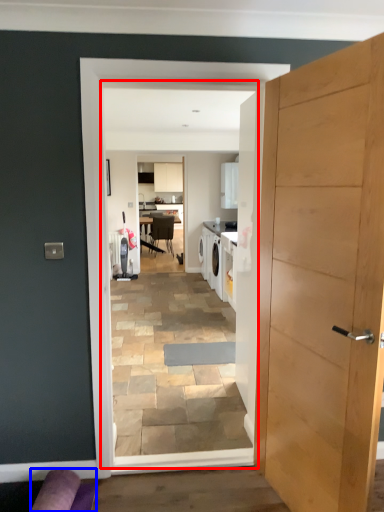
Question: Which point is further to the camera, residence (highlighted by a red box) or couch (highlighted by a blue box)?

Choices:
 (A) residence
 (B) couch

Answer: (A)